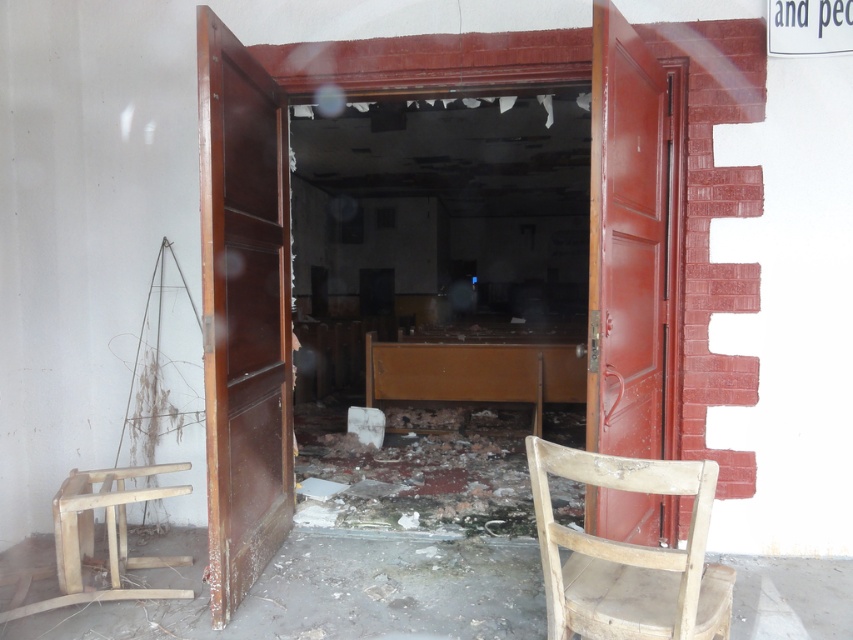
Is point (259, 241) behind point (656, 566)?

Yes, point (259, 241) is behind point (656, 566).

Does mahogany wood door at center have a greater width compared to wooden chair at lower right?

No, mahogany wood door at center is not wider than wooden chair at lower right.

Which is behind, point (247, 369) or point (550, 584)?

The point (247, 369) is more distant.

Where is `mahogany wood door at center`? This screenshot has width=853, height=640. mahogany wood door at center is located at coordinates (242, 310).

Which is more to the right, smooth glossy wood door at right or wooden chair at lower right?

From the viewer's perspective, smooth glossy wood door at right appears more on the right side.

From the picture: Which is more to the left, smooth glossy wood door at right or wooden chair at lower right?

wooden chair at lower right

Is point (663, 140) in front of point (683, 612)?

No, it is behind (683, 612).

Identify the location of smooth glossy wood door at right. The height and width of the screenshot is (640, 853). (625, 241).

Who is more distant from viewer, (264, 216) or (57, 580)?

Point (264, 216)

What do you see at coordinates (242, 310) in the screenshot? This screenshot has width=853, height=640. I see `mahogany wood door at center` at bounding box center [242, 310].

The width and height of the screenshot is (853, 640). I want to click on mahogany wood door at center, so click(x=242, y=310).